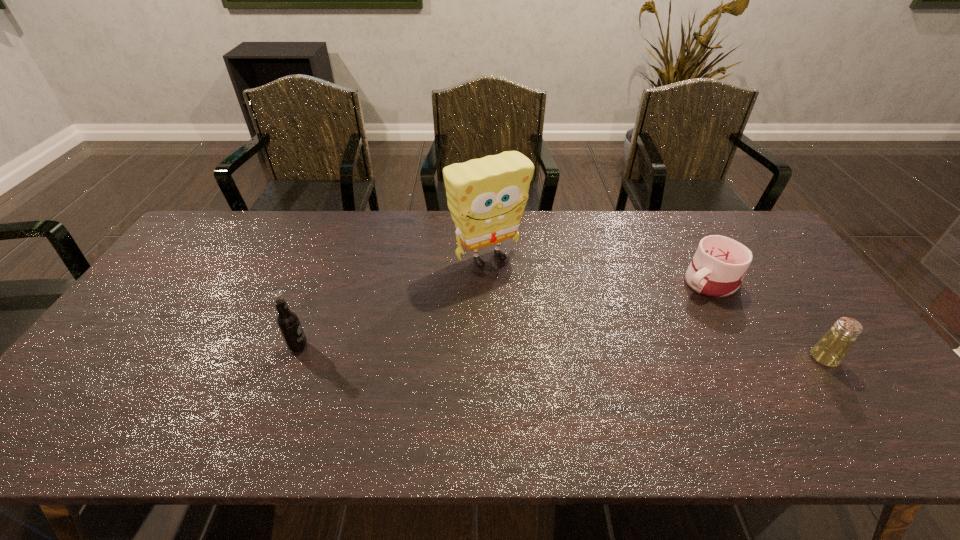
At what (x,y) coordinates should I click in order to perform the action: click on vacant space on the desktop that is between the second tallest object and the rightmost object and is positioned on the face of the sponge. Please return your answer as a coordinate pair (x, y). This screenshot has height=540, width=960. Looking at the image, I should click on pyautogui.click(x=565, y=353).

The width and height of the screenshot is (960, 540). I want to click on free space on the desktop that is between the leftmost object and the saltshaker and is positioned on the side with the handle of the second object from right to left, so click(566, 353).